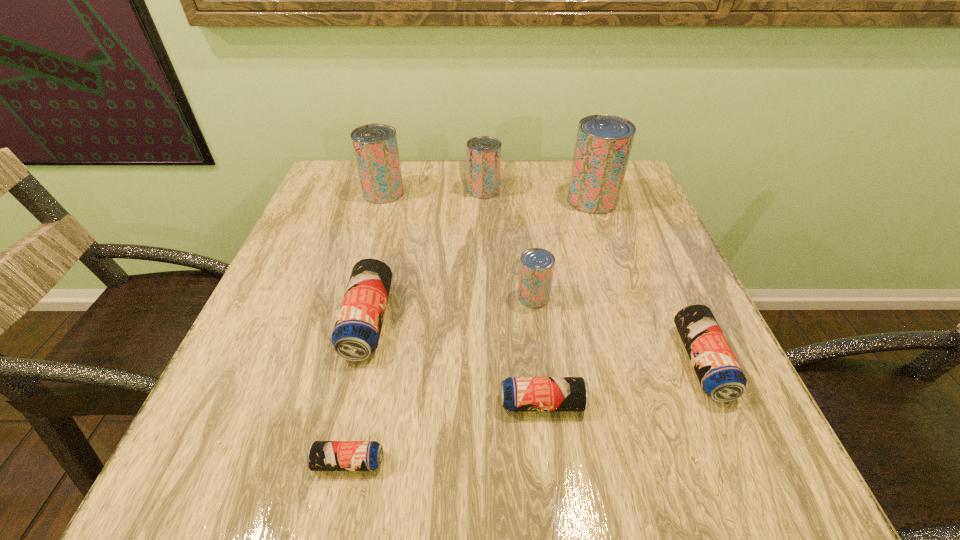
Where is `red beer can that is the third closest to the fifth shortest object`? red beer can that is the third closest to the fifth shortest object is located at coordinates (375, 146).

Where is `red beer can identified as the closest to the nearest object`? The width and height of the screenshot is (960, 540). red beer can identified as the closest to the nearest object is located at coordinates (536, 270).

At what (x,y) coordinates should I click in order to perform the action: click on blue beer can that is the third nearest to the second tallest object. Please return your answer as a coordinate pair (x, y). Looking at the image, I should click on (322, 455).

The height and width of the screenshot is (540, 960). I want to click on blue beer can that is the closest one to the fourth shortest beer can, so click(x=322, y=455).

I want to click on vacant space that satisfies the following two spatial constraints: 1. on the back side of the smallest blue beer can; 2. on the right side of the third biggest blue beer can, so click(362, 403).

Identify the location of free spot that satisfies the following two spatial constraints: 1. on the front side of the rightmost red beer can; 2. on the right side of the second smallest red beer can. This screenshot has height=540, width=960. (484, 200).

I want to click on vacant space that satisfies the following two spatial constraints: 1. on the front side of the third tallest object; 2. on the left side of the nearest red beer can, so click(x=485, y=296).